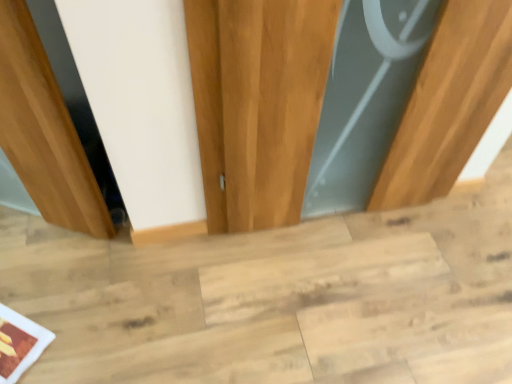
Where is `free point above light wood stair at center (from a real-world perspective)`? The width and height of the screenshot is (512, 384). free point above light wood stair at center (from a real-world perspective) is located at coordinates (290, 280).